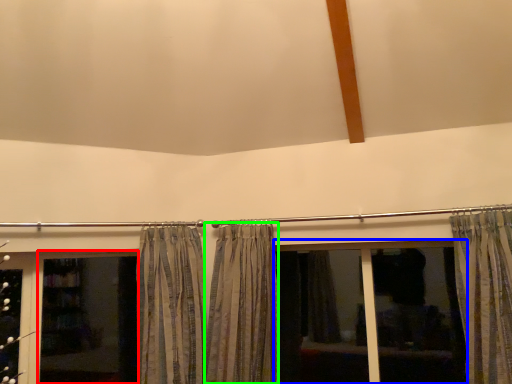
Question: Estimate the real-world distances between objects in this image. Which object is closer to screen door (highlighted by a red box), bay window (highlighted by a blue box) or curtain (highlighted by a green box)?

Choices:
 (A) bay window
 (B) curtain

Answer: (B)